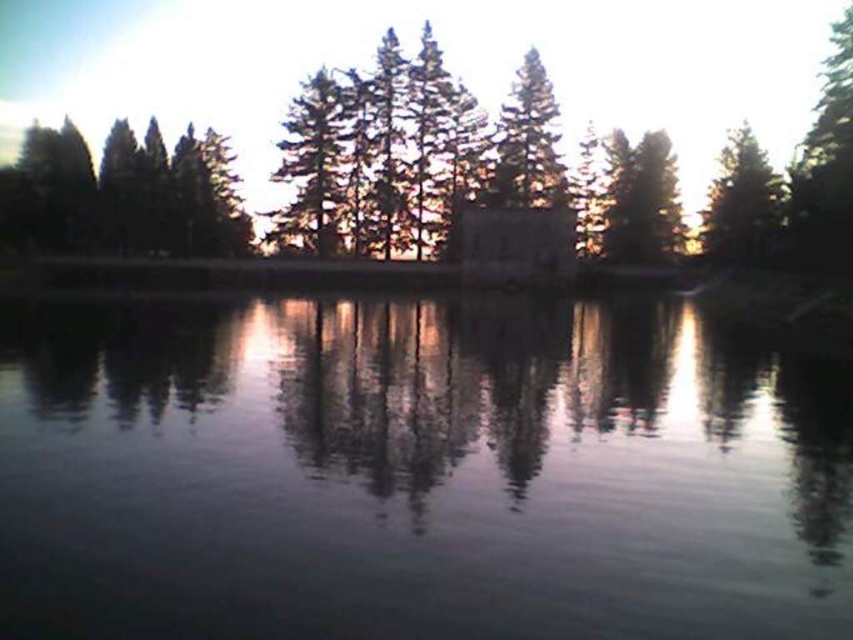
Based on the photo, you are standing on the shore of the water and want to reach the green matte tree at upper right. Which direction should you walk to get closer to it, considering the arrangement of the green matte trees at left?

You should walk towards the right side of the green matte trees at left because the green matte tree at upper right is positioned further away from the viewer compared to the green matte trees at left.

You are standing at the edge of the water in the serene natural scene. You notice two points marked in the image. The first point is at coordinates point (489, 352), and the second point is at coordinates point (769, 209). Which of these two points is closer to you as you face the water?

Point (489, 352) is in front of point (769, 209), so it is closer to you as you face the water.